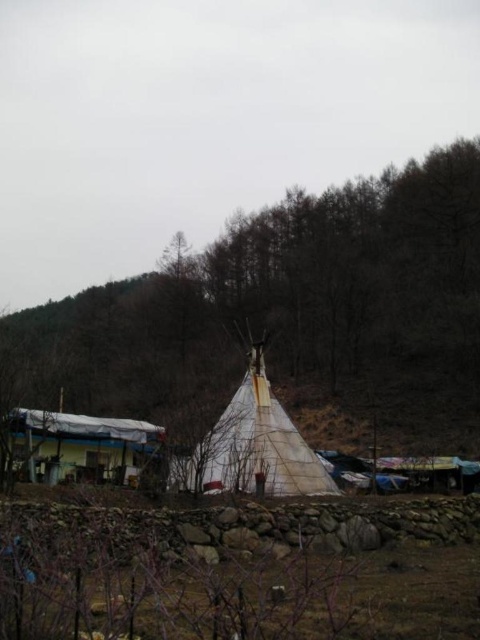
You are standing at the point with coordinates point (252, 445). Looking around, you notice a white canvas tent at center. What object is located at your current position?

The point (252, 445) indicates the location of the white canvas tent at center.

You are standing in the rural outdoor scene described. You want to take a photo of the white fabric teepee at center. Where should you position yourself to ensure the teepee is centered in your camera viewfinder?

To center the white fabric teepee at center in your camera viewfinder, position yourself directly in front of it at point (285, 310).

You are a hiker planning to set up a campsite. You have two white canvas tents available. The scene shows a white canvas tent at center and a white canvas tent at lower left. Which tent is positioned higher in the image?

The white canvas tent at center is positioned higher than the white canvas tent at lower left in the image.